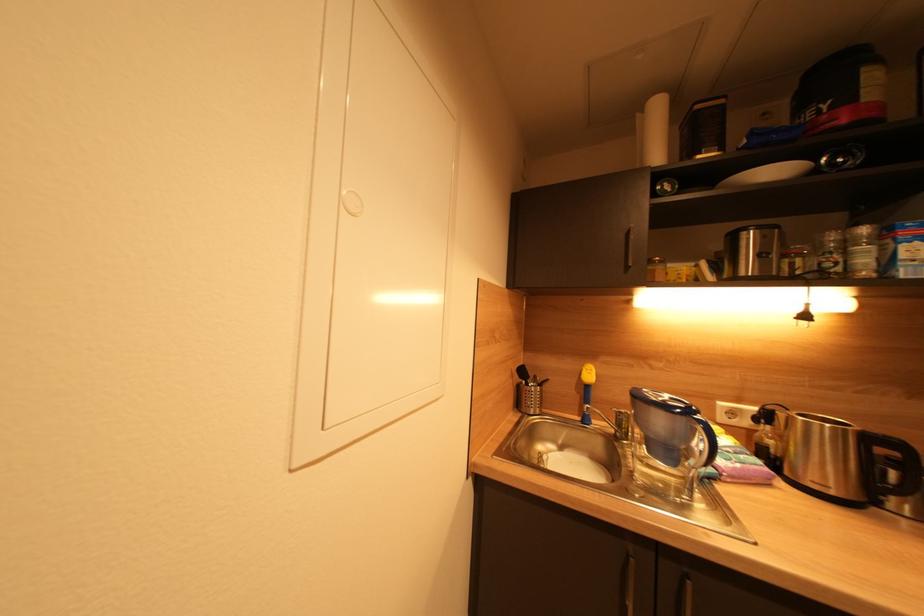
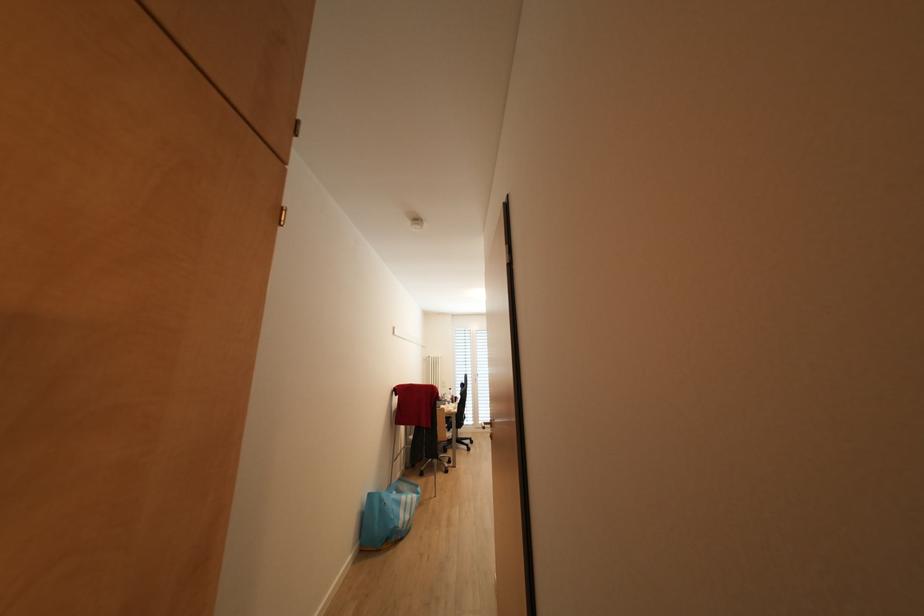
Question: The camera is either moving clockwise (left) or counter-clockwise (right) around the object. The first image is from the beginning of the video and the second image is from the end. Is the camera moving left or right when shooting the video?

Choices:
 (A) Left
 (B) Right

Answer: (B)